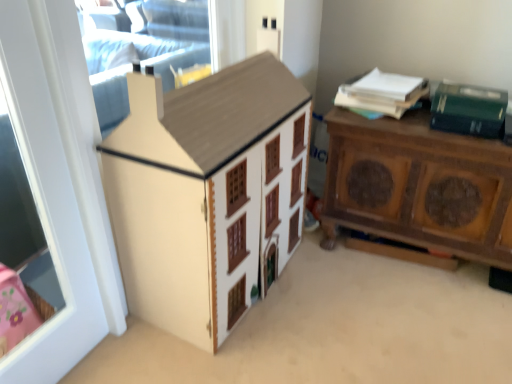
Question: Does white paper at upper right have a lesser width compared to green matte box at upper right?

Choices:
 (A) yes
 (B) no

Answer: (B)

Question: From a real-world perspective, is white paper at upper right below green matte box at upper right?

Choices:
 (A) no
 (B) yes

Answer: (B)

Question: Could you tell me if white paper at upper right is turned towards green matte box at upper right?

Choices:
 (A) yes
 (B) no

Answer: (B)

Question: Considering the relative positions of white paper at upper right and green matte box at upper right in the image provided, is white paper at upper right in front of green matte box at upper right?

Choices:
 (A) no
 (B) yes

Answer: (A)

Question: Can you see white paper at upper right touching green matte box at upper right?

Choices:
 (A) yes
 (B) no

Answer: (B)

Question: Relative to brown wood nightstand at right, is green matte box at upper right in front or behind?

Choices:
 (A) front
 (B) behind

Answer: (B)

Question: In terms of size, does green matte box at upper right appear bigger or smaller than brown wood nightstand at right?

Choices:
 (A) small
 (B) big

Answer: (A)

Question: Considering the positions of point (451, 99) and point (471, 198), is point (451, 99) closer or farther from the camera than point (471, 198)?

Choices:
 (A) closer
 (B) farther

Answer: (A)

Question: From a real-world perspective, is green matte box at upper right positioned above or below brown wood nightstand at right?

Choices:
 (A) below
 (B) above

Answer: (B)

Question: In terms of width, does white glossy door at left look wider or thinner when compared to brown wood nightstand at right?

Choices:
 (A) wide
 (B) thin

Answer: (B)

Question: In terms of height, does white glossy door at left look taller or shorter compared to brown wood nightstand at right?

Choices:
 (A) short
 (B) tall

Answer: (B)

Question: Is white glossy door at left to the left or to the right of brown wood nightstand at right in the image?

Choices:
 (A) right
 (B) left

Answer: (B)

Question: Choose the correct answer: Is white glossy door at left inside brown wood nightstand at right or outside it?

Choices:
 (A) inside
 (B) outside

Answer: (B)

Question: From a real-world perspective, is white glossy door at left above or below matte wood cabinet at center?

Choices:
 (A) below
 (B) above

Answer: (B)

Question: Is white glossy door at left inside or outside of matte wood cabinet at center?

Choices:
 (A) inside
 (B) outside

Answer: (B)